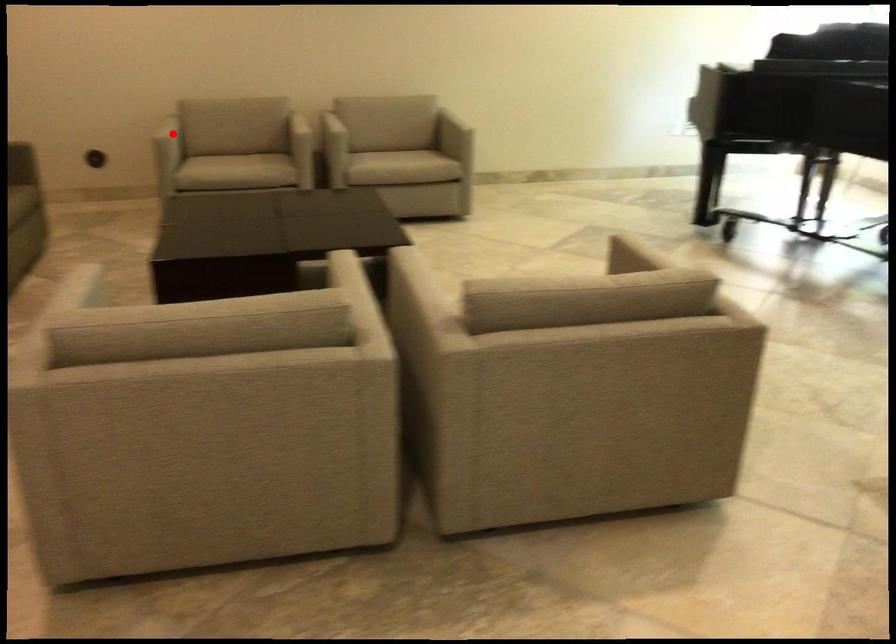
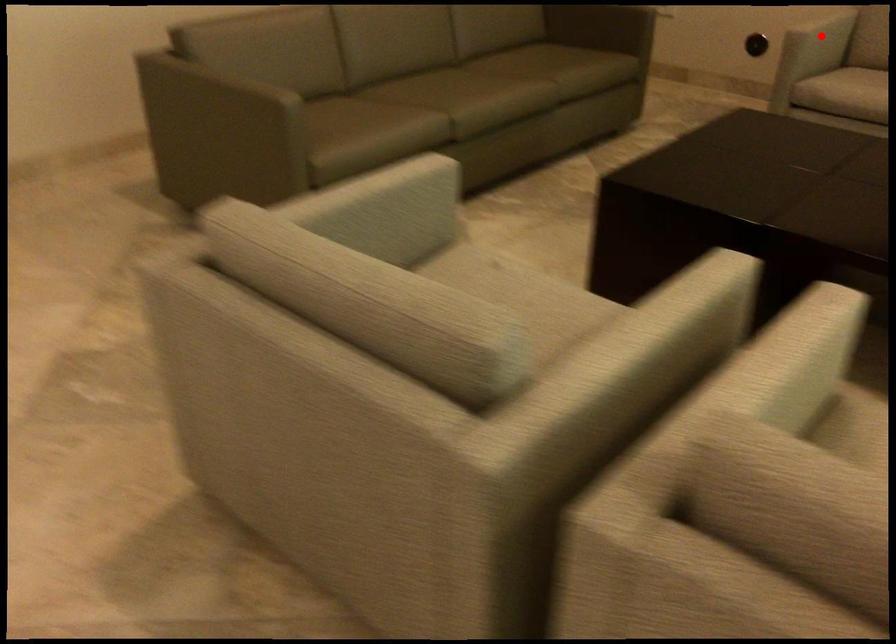
I am providing you with two images of the same scene from different viewpoints. A red point is marked on the first image and another point is marked on the second image. Does the point marked in image1 correspond to the same location as the one in image2?

Yes